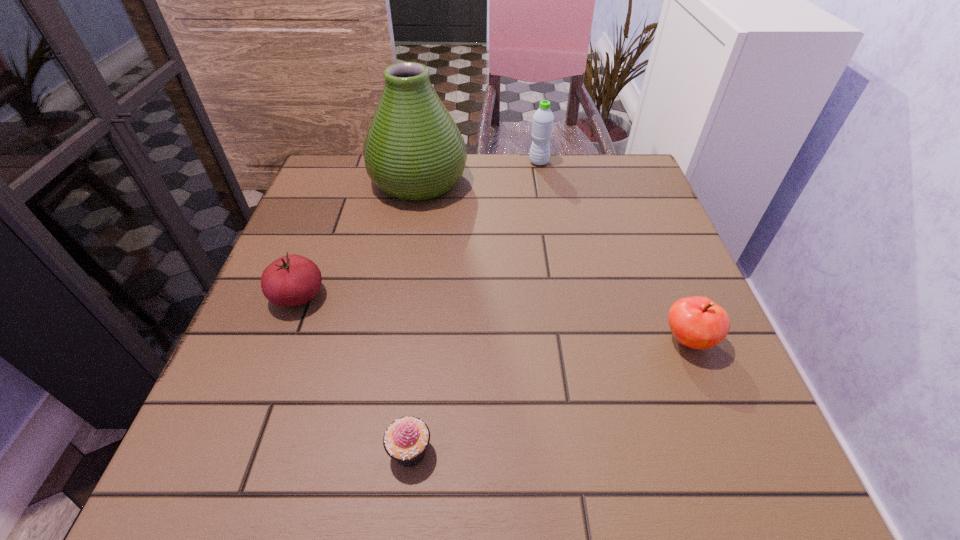
Find the location of a particular element. This screenshot has height=540, width=960. blank area located 0.290m on the front of the water bottle is located at coordinates (552, 240).

Locate an element on the screen. This screenshot has width=960, height=540. free location located on the left of the fourth farthest object is located at coordinates 627,340.

I want to click on free space located on the right of the leftmost object, so click(x=429, y=296).

At what (x,y) coordinates should I click in order to perform the action: click on blank space located 0.050m on the back of the shortest object. Please return your answer as a coordinate pair (x, y). Image resolution: width=960 pixels, height=540 pixels. Looking at the image, I should click on (416, 400).

The image size is (960, 540). Find the location of `vase located at the far edge`. vase located at the far edge is located at coordinates (413, 150).

At what (x,y) coordinates should I click in order to perform the action: click on water bottle that is at the far edge. Please return your answer as a coordinate pair (x, y). Image resolution: width=960 pixels, height=540 pixels. Looking at the image, I should click on (543, 119).

I want to click on object that is at the near edge, so click(406, 439).

Find the location of a particular element. The width and height of the screenshot is (960, 540). vase that is at the left edge is located at coordinates (413, 150).

Identify the location of tomato that is positioned at the left edge. This screenshot has height=540, width=960. (291, 280).

The height and width of the screenshot is (540, 960). Find the location of `object at the right edge`. object at the right edge is located at coordinates (697, 322).